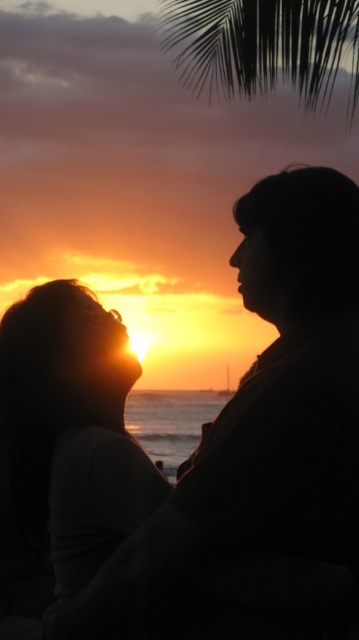
Can you confirm if silhouette couple at center is bigger than matte black hair at lower left?

Yes.

The width and height of the screenshot is (359, 640). I want to click on silhouette couple at center, so click(198, 445).

Find the location of a particular element. The image size is (359, 640). silhouette couple at center is located at coordinates (198, 445).

Is silhouette couple at center closer to the viewer compared to green leafy palm tree at upper center?

Yes.

Does silhouette couple at center have a lesser width compared to green leafy palm tree at upper center?

Yes, silhouette couple at center is thinner than green leafy palm tree at upper center.

Does point (63, 307) come farther from viewer compared to point (324, 102)?

No, (63, 307) is in front of (324, 102).

This screenshot has width=359, height=640. I want to click on silhouette couple at center, so click(x=198, y=445).

Is matte black hair at lower left thinner than green leafy palm tree at upper center?

Result: Yes, matte black hair at lower left is thinner than green leafy palm tree at upper center.

Which is above, matte black hair at lower left or green leafy palm tree at upper center?

green leafy palm tree at upper center is higher up.

Is point (14, 445) positioned after point (179, 26)?

No, it is not.

The width and height of the screenshot is (359, 640). What are the coordinates of `matte black hair at lower left` in the screenshot? It's located at (71, 429).